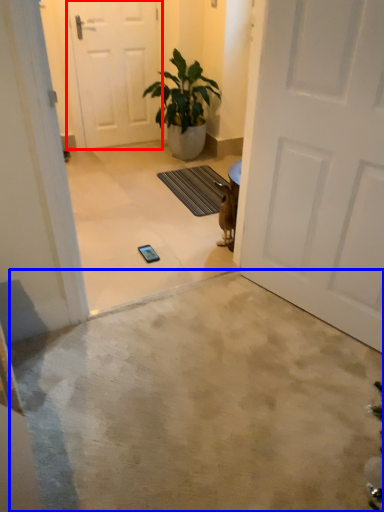
Question: Which object appears farthest to the camera in this image, door (highlighted by a red box) or concrete (highlighted by a blue box)?

Choices:
 (A) door
 (B) concrete

Answer: (A)